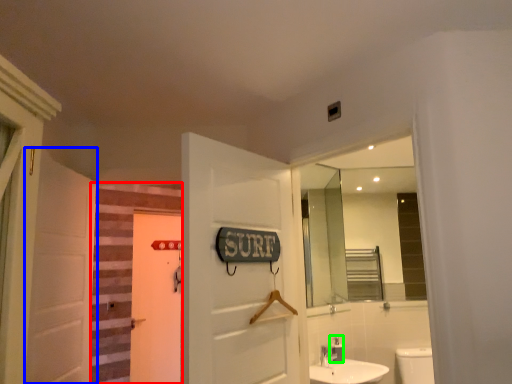
Question: Considering the real-world distances, which object is closest to stairwell (highlighted by a red box)? door (highlighted by a blue box) or toiletry (highlighted by a green box).

Choices:
 (A) door
 (B) toiletry

Answer: (A)